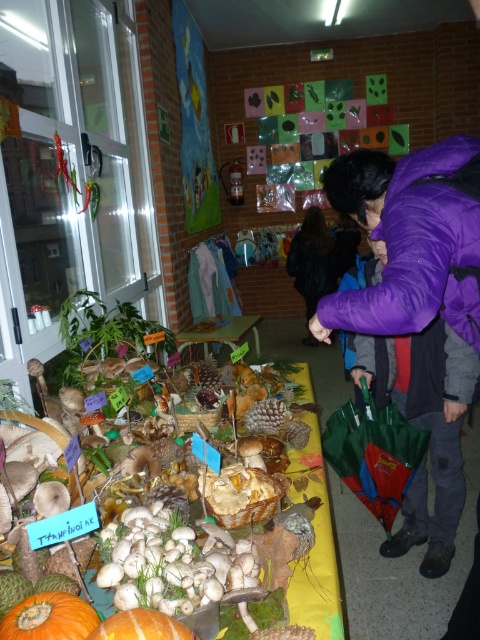
You are a visitor standing in front of the yellow table in the classroom. You see the orange matte pumpkin at lower left and the black fabric at center. Which object is nearer to you?

The orange matte pumpkin at lower left is closer to the viewer than the black fabric at center.

You are standing in front of the yellow table with mushrooms displayed. There are two points marked on the table surface. The first point is at coordinate (317, 534) and the second is at (255, 346). Which point is closer to you?

The point at coordinate (317, 534) is closer to you than the point at (255, 346).

You are organizing a classroom event and need to place a new item on the purple fleece jacket at upper right and the wooden table at center. Which surface has more space available for placing additional items?

The wooden table at center has more space available because its width is greater than the purple fleece jacket at upper right.